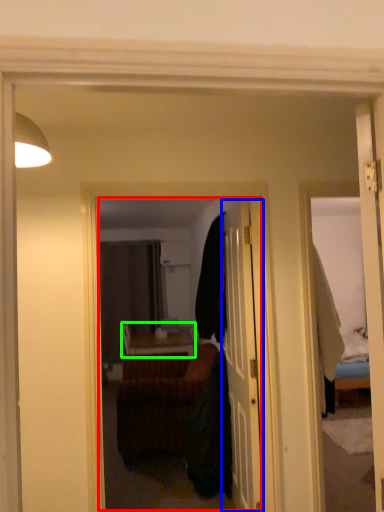
Question: Considering the real-world distances, which object is closest to mirror (highlighted by a red box)? door (highlighted by a blue box) or table (highlighted by a green box).

Choices:
 (A) door
 (B) table

Answer: (B)